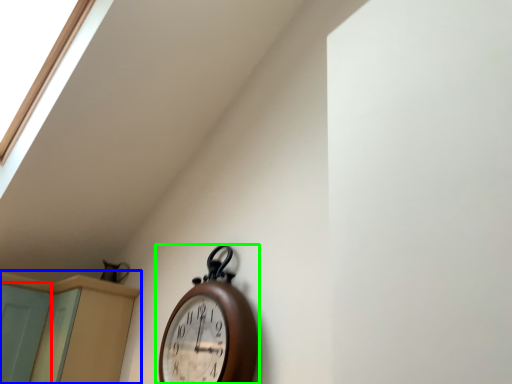
Question: Which object is positioned closest to screen door (highlighted by a red box)? Select from dresser (highlighted by a blue box) and wall clock (highlighted by a green box).

Choices:
 (A) dresser
 (B) wall clock

Answer: (A)